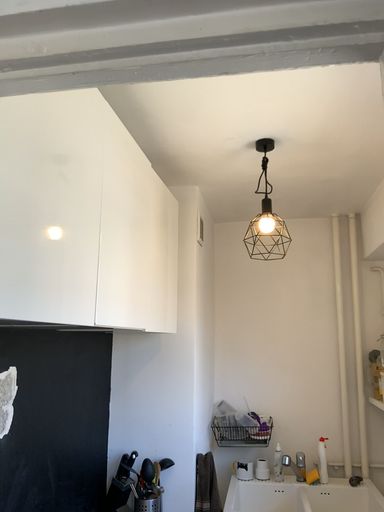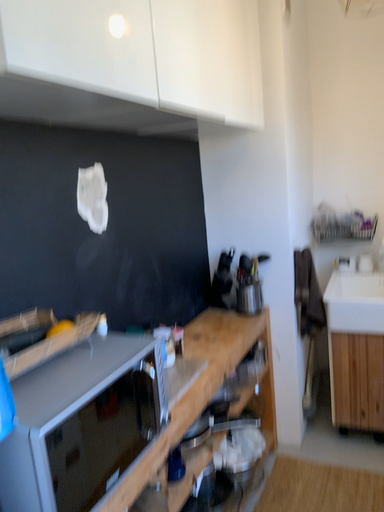
Question: How did the camera likely rotate when shooting the video?

Choices:
 (A) rotated right
 (B) rotated left

Answer: (B)